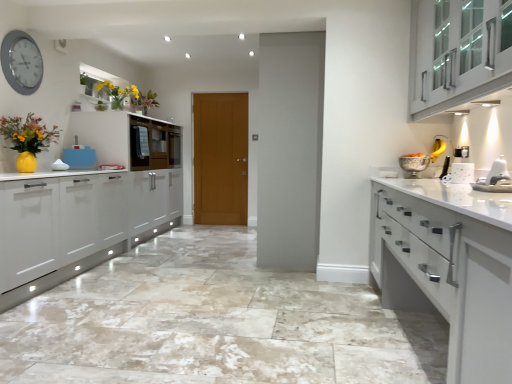
Measure the distance between point (102, 87) and camera.

The distance of point (102, 87) from camera is 4.77 meters.

Locate an element on the screen. white glossy microwave at upper left, which is counted as the 1th cabinetry, starting from the left is located at coordinates coord(129,139).

In order to click on silver metallic clock at upper left in this screenshot , I will do `click(21, 62)`.

Where is `white glossy cabinet at right, arranged as the third cabinetry when viewed from the back`? The width and height of the screenshot is (512, 384). white glossy cabinet at right, arranged as the third cabinetry when viewed from the back is located at coordinates (448, 267).

The width and height of the screenshot is (512, 384). In order to click on matte yellow vase at left, the first floral arrangement positioned from the front in this screenshot , I will do `click(28, 134)`.

Find the location of `marble tile floor at center`. marble tile floor at center is located at coordinates (214, 323).

What are the coordinates of `white glossy cabinet at upper right, the second cabinetry when ordered from back to front` in the screenshot? It's located at (458, 53).

Considering the sizes of objects white glossy cabinet at right, arranged as the third cabinetry when viewed from the back, and white glossy microwave at upper left, which ranks as the third cabinetry in front-to-back order, in the image provided, who is bigger, white glossy cabinet at right, arranged as the third cabinetry when viewed from the back, or white glossy microwave at upper left, which ranks as the third cabinetry in front-to-back order,?

white glossy cabinet at right, arranged as the third cabinetry when viewed from the back.

Is white glossy cabinet at right, the 2th cabinetry from the right, not within white glossy microwave at upper left, placed as the 1th cabinetry when sorted from back to front?

Yes, white glossy cabinet at right, the 2th cabinetry from the right, is outside of white glossy microwave at upper left, placed as the 1th cabinetry when sorted from back to front.

In the image, is white glossy cabinet at right, marked as the 1th cabinetry in a front-to-back arrangement, positioned in front of or behind white glossy microwave at upper left, which ranks as the third cabinetry in front-to-back order?

white glossy cabinet at right, marked as the 1th cabinetry in a front-to-back arrangement, is in front of white glossy microwave at upper left, which ranks as the third cabinetry in front-to-back order.

Between white glossy cabinet at right, arranged as the third cabinetry when viewed from the back, and white glossy microwave at upper left, which is counted as the 1th cabinetry, starting from the left, which one has more height?

Standing taller between the two is white glossy cabinet at right, arranged as the third cabinetry when viewed from the back.

Which object is closer to the camera, white glossy cabinet at upper right, which is the first cabinetry from right to left, or silver metallic clock at upper left?

Positioned in front is white glossy cabinet at upper right, which is the first cabinetry from right to left.

From the image's perspective, which one is positioned higher, white glossy cabinet at upper right, which is the 3th cabinetry in left-to-right order, or silver metallic clock at upper left?

silver metallic clock at upper left, from the image's perspective.

Do you think white glossy cabinet at upper right, the second cabinetry when ordered from back to front, is within silver metallic clock at upper left, or outside of it?

white glossy cabinet at upper right, the second cabinetry when ordered from back to front, is spatially situated outside silver metallic clock at upper left.

From a real-world perspective, relative to silver metallic clock at upper left, is white glossy cabinet at upper right, which is the first cabinetry from right to left, vertically above or below?

Clearly, from a real-world perspective, white glossy cabinet at upper right, which is the first cabinetry from right to left, is below silver metallic clock at upper left.

Could you tell me if white glossy microwave at upper left, placed as the 1th cabinetry when sorted from back to front, is turned towards matte yellow vase at left, which is the second floral arrangement from top to bottom?

No, white glossy microwave at upper left, placed as the 1th cabinetry when sorted from back to front, is not facing towards matte yellow vase at left, which is the second floral arrangement from top to bottom.

How different are the orientations of white glossy microwave at upper left, placed as the 1th cabinetry when sorted from back to front, and matte yellow vase at left, the 1th floral arrangement viewed from the left, in degrees?

The angular difference between white glossy microwave at upper left, placed as the 1th cabinetry when sorted from back to front, and matte yellow vase at left, the 1th floral arrangement viewed from the left, is 0.174 degrees.

From a real-world perspective, relative to matte yellow vase at left, which appears as the 2th floral arrangement when viewed from the back, is white glossy microwave at upper left, which is the third cabinetry from right to left, vertically above or below?

white glossy microwave at upper left, which is the third cabinetry from right to left, is situated higher than matte yellow vase at left, which appears as the 2th floral arrangement when viewed from the back, in the real world.

Which is behind, point (103, 160) or point (34, 131)?

The point (103, 160) is farther from the camera.

Which object is thinner, white glossy cabinet at right, marked as the 1th cabinetry in a front-to-back arrangement, or wooden door at center?

wooden door at center is thinner.

Which of these two, white glossy cabinet at right, arranged as the third cabinetry when viewed from the back, or wooden door at center, stands shorter?

With less height is white glossy cabinet at right, arranged as the third cabinetry when viewed from the back.

Based on the photo, is white glossy cabinet at right, marked as the 1th cabinetry in a front-to-back arrangement, at the left side of wooden door at center?

Incorrect, white glossy cabinet at right, marked as the 1th cabinetry in a front-to-back arrangement, is not on the left side of wooden door at center.

Which is behind, white glossy cabinet at right, marked as the 1th cabinetry in a front-to-back arrangement, or wooden door at center?

wooden door at center.

Is white glossy cabinet at right, which is the second cabinetry in left-to-right order, outside of white glossy cabinet at upper right, which is the 3th cabinetry in left-to-right order?

Indeed, white glossy cabinet at right, which is the second cabinetry in left-to-right order, is completely outside white glossy cabinet at upper right, which is the 3th cabinetry in left-to-right order.

Which point is more forward, (x=450, y=324) or (x=430, y=19)?

The point (x=450, y=324) is closer to the camera.

Is white glossy cabinet at right, which is the second cabinetry in left-to-right order, bigger than white glossy cabinet at upper right, which is the second cabinetry from front to back?

Correct, white glossy cabinet at right, which is the second cabinetry in left-to-right order, is larger in size than white glossy cabinet at upper right, which is the second cabinetry from front to back.

Can you tell me how much white glossy cabinet at right, marked as the 1th cabinetry in a front-to-back arrangement, and white glossy cabinet at upper right, the second cabinetry when ordered from back to front, differ in facing direction?

The angular difference between white glossy cabinet at right, marked as the 1th cabinetry in a front-to-back arrangement, and white glossy cabinet at upper right, the second cabinetry when ordered from back to front, is 0.0533 degrees.

Considering their positions, is silver metallic clock at upper left located in front of or behind white glossy cabinet at right, marked as the 1th cabinetry in a front-to-back arrangement?

In the image, silver metallic clock at upper left appears behind white glossy cabinet at right, marked as the 1th cabinetry in a front-to-back arrangement.

Which object is thinner, silver metallic clock at upper left or white glossy cabinet at right, which is the second cabinetry in left-to-right order?

silver metallic clock at upper left.

Is silver metallic clock at upper left not inside white glossy cabinet at right, which is the second cabinetry in left-to-right order?

silver metallic clock at upper left lies outside white glossy cabinet at right, which is the second cabinetry in left-to-right order,'s area.

From the image's perspective, is silver metallic clock at upper left positioned above or below white glossy cabinet at right, marked as the 1th cabinetry in a front-to-back arrangement?

Clearly, from the image's perspective, silver metallic clock at upper left is above white glossy cabinet at right, marked as the 1th cabinetry in a front-to-back arrangement.

Is white glossy microwave at upper left, which ranks as the third cabinetry in front-to-back order, smaller than white glossy cabinet at right, which is the second cabinetry in left-to-right order?

Yes.

Which is correct: white glossy microwave at upper left, which is counted as the 1th cabinetry, starting from the left, is inside white glossy cabinet at right, marked as the 1th cabinetry in a front-to-back arrangement, or outside of it?

white glossy microwave at upper left, which is counted as the 1th cabinetry, starting from the left, is outside white glossy cabinet at right, marked as the 1th cabinetry in a front-to-back arrangement.

From the image's perspective, is white glossy microwave at upper left, placed as the 1th cabinetry when sorted from back to front, below white glossy cabinet at right, the 2th cabinetry from the right?

No, from the image's perspective, white glossy microwave at upper left, placed as the 1th cabinetry when sorted from back to front, is not below white glossy cabinet at right, the 2th cabinetry from the right.

You are a GUI agent. You are given a task and a screenshot of the screen. Output one action in this format:
    pyautogui.click(x=<x>, y=<y>)
    Task: Click on the 1st cabinetry to the right when counting from the white glossy microwave at upper left, which is counted as the 1th cabinetry, starting from the left
    This screenshot has height=384, width=512.
    Given the screenshot: What is the action you would take?
    pyautogui.click(x=448, y=267)

Identify the location of the 1st cabinetry in front of the silver metallic clock at upper left. The image size is (512, 384). (458, 53).

When comparing their distances from white plastic toaster at right, does wooden door at center or white glossy sink at right seem further?

wooden door at center.

Which object lies further to the anchor point white glossy cabinet at upper right, which is the second cabinetry from front to back, marble tile floor at center or wooden door at center?

wooden door at center.

Estimate the real-world distances between objects in this image. Which object is further from silver metallic clock at upper left, white glossy microwave at upper left, which is counted as the 1th cabinetry, starting from the left, or white glossy sink at right?

Based on the image, white glossy sink at right appears to be further to silver metallic clock at upper left.

Which object lies further to the anchor point white glossy cabinet at right, which is the second cabinetry in left-to-right order, marble tile floor at center or silver metallic clock at upper left?

Among the two, silver metallic clock at upper left is located further to white glossy cabinet at right, which is the second cabinetry in left-to-right order.

When comparing their distances from marble tile floor at center, does white glossy cabinet at right, which is the second cabinetry in left-to-right order, or silver metallic clock at upper left seem closer?

white glossy cabinet at right, which is the second cabinetry in left-to-right order.

From the picture: When comparing their distances from wooden door at center, does marble tile floor at center or white glossy microwave at upper left, placed as the 1th cabinetry when sorted from back to front, seem closer?

white glossy microwave at upper left, placed as the 1th cabinetry when sorted from back to front, is positioned closer to the anchor wooden door at center.

Based on their spatial positions, is white glossy cabinet at right, arranged as the third cabinetry when viewed from the back, or marble tile floor at center closer to white glossy microwave at upper left, which ranks as the third cabinetry in front-to-back order?

Among the two, marble tile floor at center is located nearer to white glossy microwave at upper left, which ranks as the third cabinetry in front-to-back order.

In the scene shown: Estimate the real-world distances between objects in this image. Which object is closer to wooden door at center, white glossy sink at right or white glossy microwave at upper left, placed as the 1th cabinetry when sorted from back to front?

white glossy microwave at upper left, placed as the 1th cabinetry when sorted from back to front, is closer to wooden door at center.

Locate an element on the screen. cabinetry located between white glossy cabinet at right, which is the second cabinetry in left-to-right order, and matte glass vase at upper left, which is counted as the 2th floral arrangement, starting from the bottom, in the depth direction is located at coordinates (458, 53).

Find the location of a particular element. sink between marble tile floor at center and white plastic toaster at right is located at coordinates (495, 178).

Image resolution: width=512 pixels, height=384 pixels. I want to click on floral arrangement positioned between silver metallic clock at upper left and white glossy microwave at upper left, which is the third cabinetry from right to left, from near to far, so click(118, 93).

This screenshot has height=384, width=512. I want to click on floral arrangement situated between matte yellow vase at left, the first floral arrangement positioned from the front, and white glossy sink at right from left to right, so point(118,93).